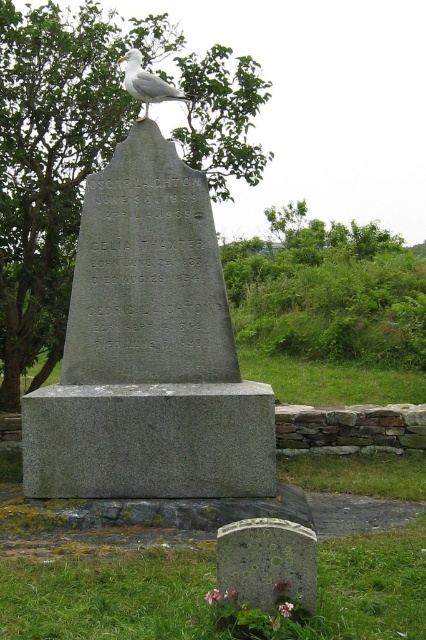
You are standing in front of the gray granite monument at center and want to take a photo of the white feathered bird at upper center. Can you see the bird clearly without any obstruction?

The gray granite monument at center is in front of the white feathered bird at upper center, so the monument will block your view of the bird. You won not be able to see the bird clearly.

You are a park ranger inspecting the monument area. You notice the speckled stone gravestone at lower center and the white feathered bird at upper center. Which object occupies a smaller horizontal space in the scene?

The speckled stone gravestone at lower center has a lesser width compared to the white feathered bird at upper center, so it occupies a smaller horizontal space.